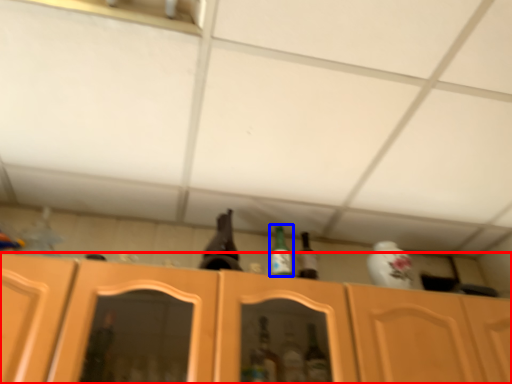
Question: Which object appears farthest to the camera in this image, cabinetry (highlighted by a red box) or bottle (highlighted by a blue box)?

Choices:
 (A) cabinetry
 (B) bottle

Answer: (B)